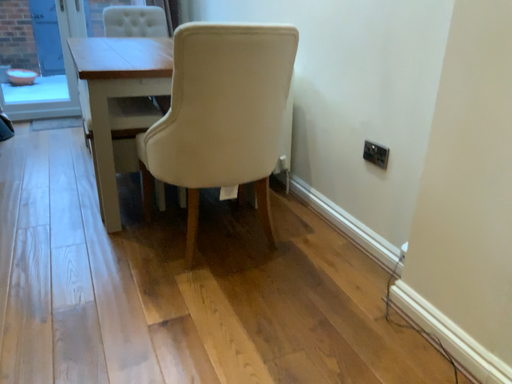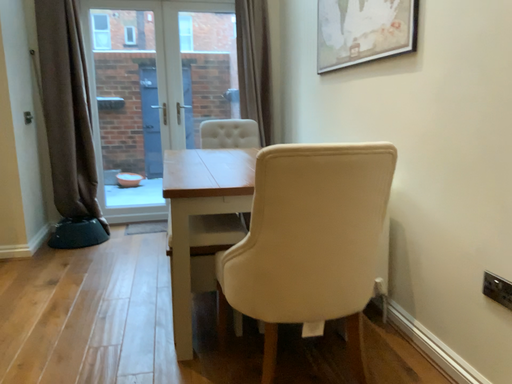
Question: How did the camera likely rotate when shooting the video?

Choices:
 (A) rotated left
 (B) rotated right

Answer: (A)